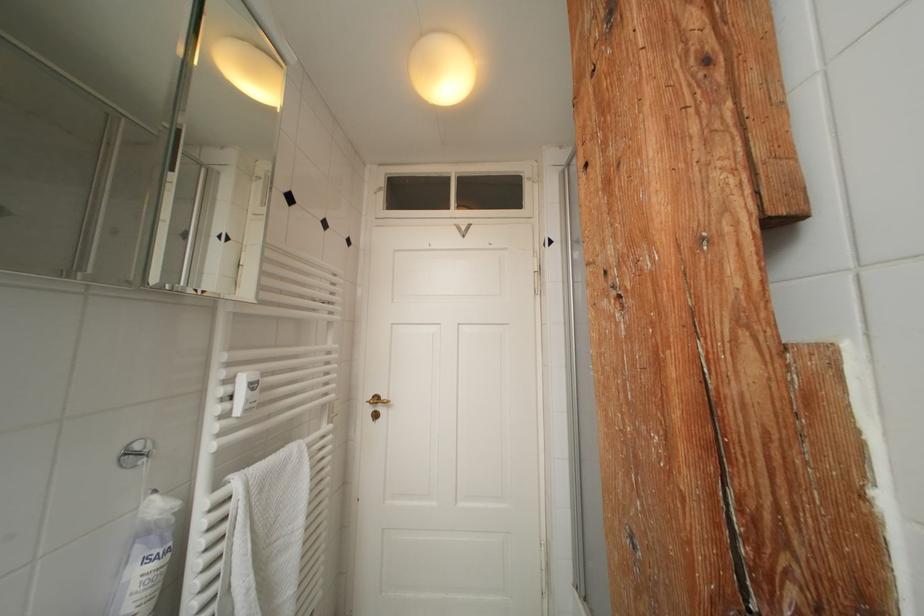
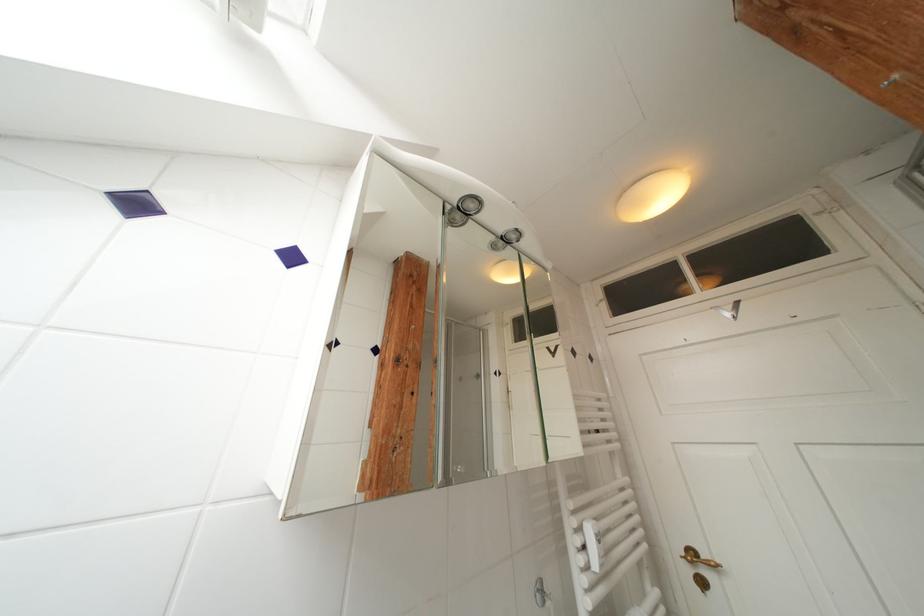
Locate, in the second image, the point that corresponds to [236,384] in the first image.

(586, 533)